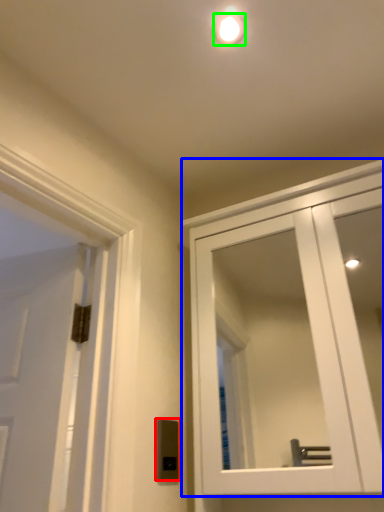
Question: Based on their relative distances, which object is nearer to light switch (highlighted by a red box)? Choose from cabinetry (highlighted by a blue box) and droplight (highlighted by a green box).

Choices:
 (A) cabinetry
 (B) droplight

Answer: (B)